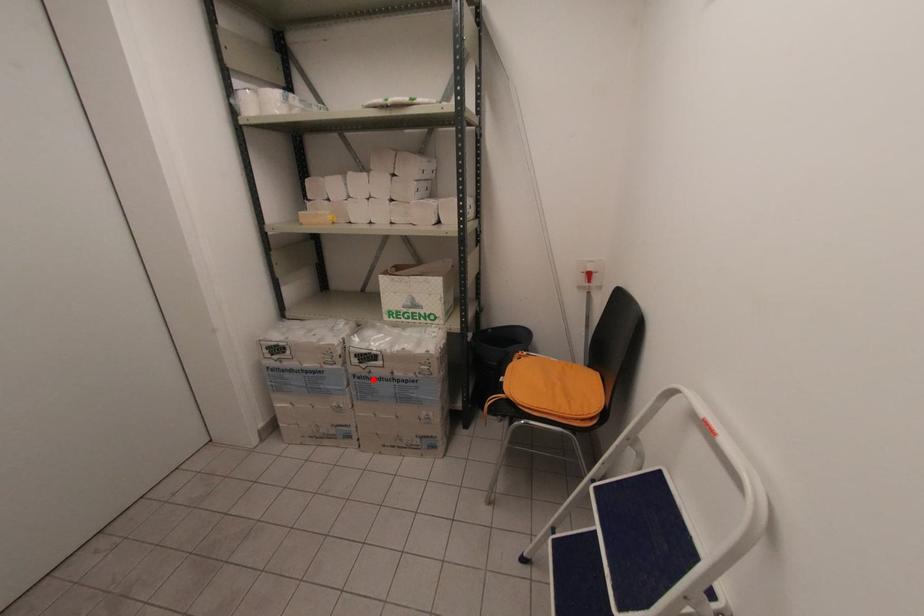
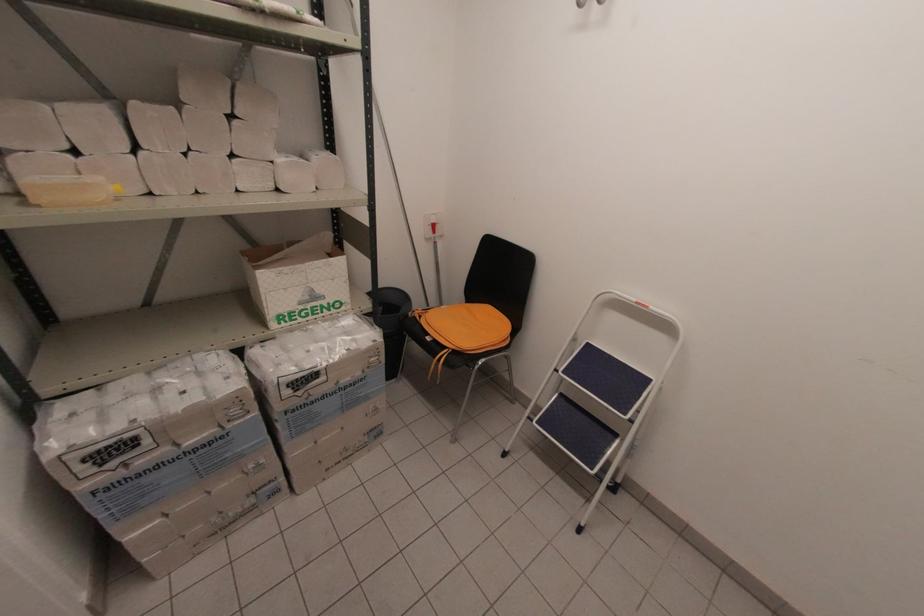
Question: I am providing you with two images of the same scene from different viewpoints. A red point is marked on the first image. At the location where the point appears in image 1, is it still visible in image 2?

Choices:
 (A) Yes
 (B) No

Answer: (A)